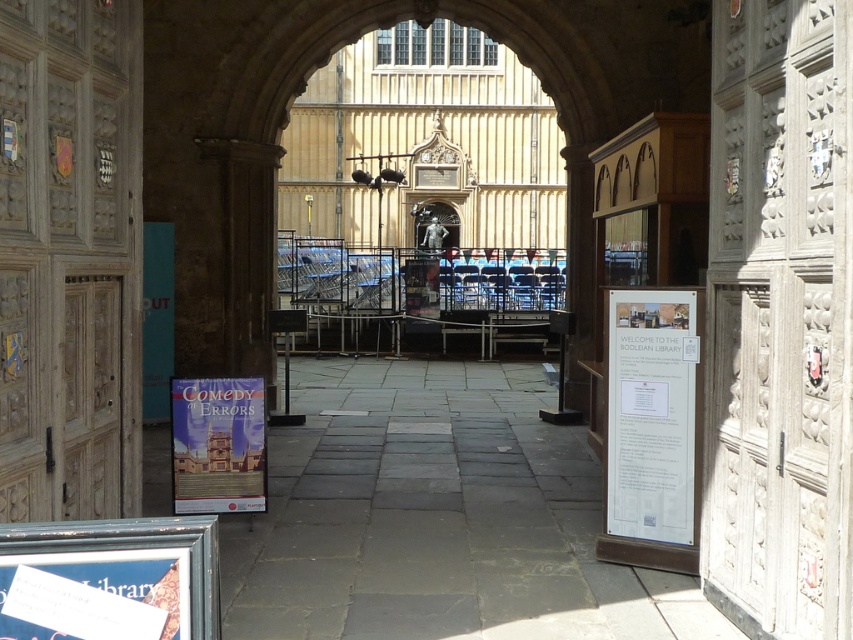
Question: Does white paper at right have a smaller size compared to matte paper poster at lower left?

Choices:
 (A) yes
 (B) no

Answer: (B)

Question: Which point appears farthest from the camera in this image?

Choices:
 (A) (236, 468)
 (B) (122, 588)

Answer: (A)

Question: Observing the image, what is the correct spatial positioning of white paper at right in reference to matte paper poster at center?

Choices:
 (A) above
 (B) below

Answer: (A)

Question: Among these objects, which one is nearest to the camera?

Choices:
 (A) matte paper poster at lower left
 (B) white paper at right

Answer: (A)

Question: Which of the following is the farthest from the observer?

Choices:
 (A) (241, 426)
 (B) (41, 618)
 (C) (682, 429)

Answer: (A)

Question: Is white paper at right smaller than matte paper poster at lower left?

Choices:
 (A) yes
 (B) no

Answer: (B)